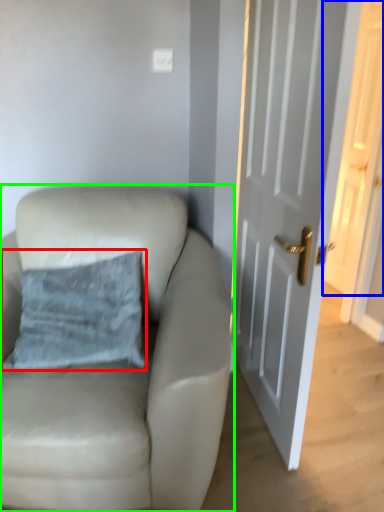
Question: Considering the real-world distances, which object is closest to pillow (highlighted by a red box)? door (highlighted by a blue box) or chair (highlighted by a green box).

Choices:
 (A) door
 (B) chair

Answer: (B)